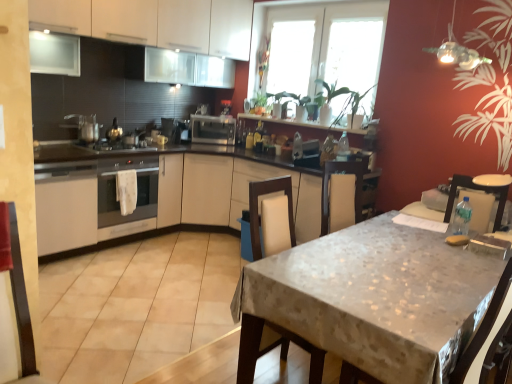
Question: Would you say white fabric swivel chair at right, the 2th swivel chair when ordered from left to right, is to the left or to the right of satin silver toaster at center, the first appliance viewed from the right, in the picture?

Choices:
 (A) right
 (B) left

Answer: (A)

Question: Considering the positions of white fabric swivel chair at right, the 2th swivel chair when ordered from left to right, and satin silver toaster at center, which is counted as the 3th appliance, starting from the front, in the image, is white fabric swivel chair at right, the 2th swivel chair when ordered from left to right, taller or shorter than satin silver toaster at center, which is counted as the 3th appliance, starting from the front,?

Choices:
 (A) short
 (B) tall

Answer: (B)

Question: Estimate the real-world distances between objects in this image. Which object is closer to the transparent glass window at upper center, which ranks as the first window in right-to-left order?

Choices:
 (A) white fabric swivel chair at right, the 2th swivel chair when ordered from left to right
 (B) beige fabric swivel chair at lower right, acting as the second swivel chair starting from the right
 (C) satin silver oven at center
 (D) satin silver toaster at center, the second appliance in the back-to-front sequence
 (E) satin silver toaster at center, marked as the 3th appliance in a left-to-right arrangement

Answer: (E)

Question: Which is farther from the transparent glass window at upper center, the second window viewed from the right?

Choices:
 (A) satin silver oven at center
 (B) white matte cabinet at left, the second cabinetry when ordered from top to bottom
 (C) white matte cabinet at upper left, placed as the 1th cabinetry when sorted from top to bottom
 (D) satin silver toaster at center, which is counted as the 3th appliance, starting from the front
 (E) satin silver toaster at center, the second appliance in the back-to-front sequence

Answer: (B)